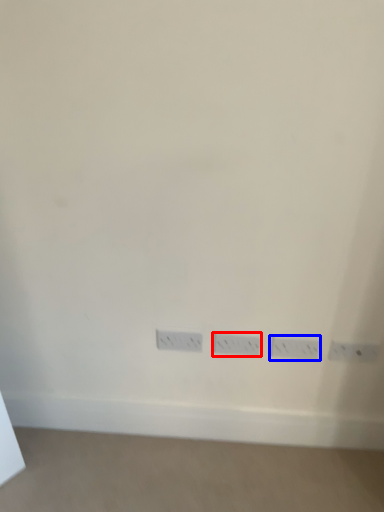
Question: Which object appears farthest to the camera in this image, power plugs and sockets (highlighted by a red box) or power plugs and sockets (highlighted by a blue box)?

Choices:
 (A) power plugs and sockets
 (B) power plugs and sockets

Answer: (A)